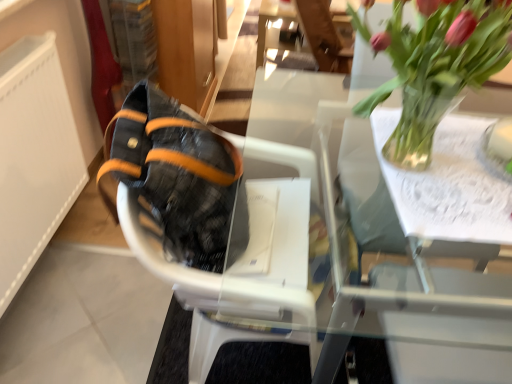
Question: From a real-world perspective, is leather-like black shoe at left positioned over translucent glass vase at upper right based on gravity?

Choices:
 (A) yes
 (B) no

Answer: (B)

Question: Is leather-like black shoe at left turned away from translucent glass vase at upper right?

Choices:
 (A) yes
 (B) no

Answer: (B)

Question: From a real-world perspective, is leather-like black shoe at left beneath translucent glass vase at upper right?

Choices:
 (A) yes
 (B) no

Answer: (A)

Question: Considering the relative positions of leather-like black shoe at left and translucent glass vase at upper right in the image provided, is leather-like black shoe at left to the right of translucent glass vase at upper right from the viewer's perspective?

Choices:
 (A) yes
 (B) no

Answer: (B)

Question: Is leather-like black shoe at left thinner than translucent glass vase at upper right?

Choices:
 (A) no
 (B) yes

Answer: (B)

Question: In the image, is white textured radiator at left on the left side or the right side of black textured fabric baby carriage at center?

Choices:
 (A) right
 (B) left

Answer: (B)

Question: Is white textured radiator at left inside or outside of black textured fabric baby carriage at center?

Choices:
 (A) outside
 (B) inside

Answer: (A)

Question: From the image's perspective, relative to black textured fabric baby carriage at center, is white textured radiator at left above or below?

Choices:
 (A) below
 (B) above

Answer: (B)

Question: Considering the positions of point (6, 283) and point (294, 163), is point (6, 283) closer or farther from the camera than point (294, 163)?

Choices:
 (A) closer
 (B) farther

Answer: (B)

Question: In the image, is translucent glass vase at upper right positioned in front of or behind white textured radiator at left?

Choices:
 (A) front
 (B) behind

Answer: (A)

Question: Visually, is translucent glass vase at upper right positioned to the left or to the right of white textured radiator at left?

Choices:
 (A) right
 (B) left

Answer: (A)

Question: Is translucent glass vase at upper right bigger or smaller than white textured radiator at left?

Choices:
 (A) big
 (B) small

Answer: (B)

Question: From the image's perspective, relative to white textured radiator at left, is translucent glass vase at upper right above or below?

Choices:
 (A) below
 (B) above

Answer: (B)

Question: Is white textured radiator at left inside or outside of transparent glass table at upper center?

Choices:
 (A) outside
 (B) inside

Answer: (A)

Question: Is point (82, 157) closer or farther from the camera than point (268, 99)?

Choices:
 (A) farther
 (B) closer

Answer: (B)